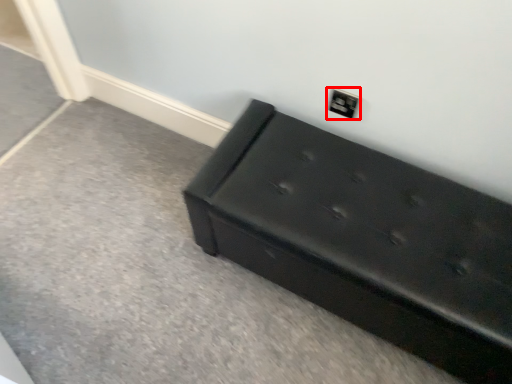
Question: From the image's perspective, considering the relative positions of electric outlet (annotated by the red box) and furniture in the image provided, where is electric outlet (annotated by the red box) located with respect to the staircase?

Choices:
 (A) below
 (B) above

Answer: (B)